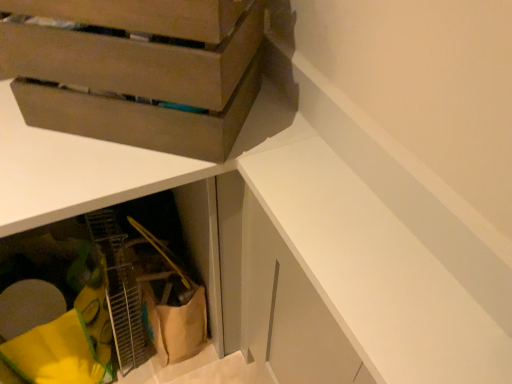
Question: Is matte brown cardboard box at upper left thinner than white matte cabinet at upper right, acting as the first cabinetry starting from the front?

Choices:
 (A) no
 (B) yes

Answer: (A)

Question: Is matte brown cardboard box at upper left wider than white matte cabinet at upper right, acting as the first cabinetry starting from the front?

Choices:
 (A) no
 (B) yes

Answer: (B)

Question: Is matte brown cardboard box at upper left taller than white matte cabinet at upper right, arranged as the 2th cabinetry when viewed from the back?

Choices:
 (A) yes
 (B) no

Answer: (A)

Question: Is matte brown cardboard box at upper left positioned beyond the bounds of white matte cabinet at upper right, which is the 2th cabinetry from left to right?

Choices:
 (A) no
 (B) yes

Answer: (B)

Question: From a real-world perspective, is matte brown cardboard box at upper left physically below white matte cabinet at upper right, marked as the 1th cabinetry in a right-to-left arrangement?

Choices:
 (A) no
 (B) yes

Answer: (A)

Question: Is matte brown cardboard box at upper left behind white matte cabinet at upper right, marked as the 1th cabinetry in a right-to-left arrangement?

Choices:
 (A) yes
 (B) no

Answer: (A)

Question: From a real-world perspective, is matte brown cardboard box at upper left located beneath yellow fabric at lower left, positioned as the 1th cabinetry in left-to-right order?

Choices:
 (A) yes
 (B) no

Answer: (B)

Question: Can you confirm if matte brown cardboard box at upper left is thinner than yellow fabric at lower left, the 1th cabinetry positioned from the back?

Choices:
 (A) no
 (B) yes

Answer: (B)

Question: From a real-world perspective, is matte brown cardboard box at upper left located higher than yellow fabric at lower left, acting as the 2th cabinetry starting from the right?

Choices:
 (A) yes
 (B) no

Answer: (A)

Question: Considering the relative sizes of matte brown cardboard box at upper left and yellow fabric at lower left, positioned as the 1th cabinetry in left-to-right order, in the image provided, is matte brown cardboard box at upper left taller than yellow fabric at lower left, positioned as the 1th cabinetry in left-to-right order,?

Choices:
 (A) yes
 (B) no

Answer: (B)

Question: Is yellow fabric at lower left, which appears as the 2th cabinetry when viewed from the front, inside matte brown cardboard box at upper left?

Choices:
 (A) no
 (B) yes

Answer: (A)

Question: Can you confirm if matte brown cardboard box at upper left is bigger than yellow fabric at lower left, acting as the 2th cabinetry starting from the right?

Choices:
 (A) no
 (B) yes

Answer: (A)

Question: Is white matte cabinet at upper right, acting as the first cabinetry starting from the front, at the right side of matte brown cardboard box at upper left?

Choices:
 (A) no
 (B) yes

Answer: (B)